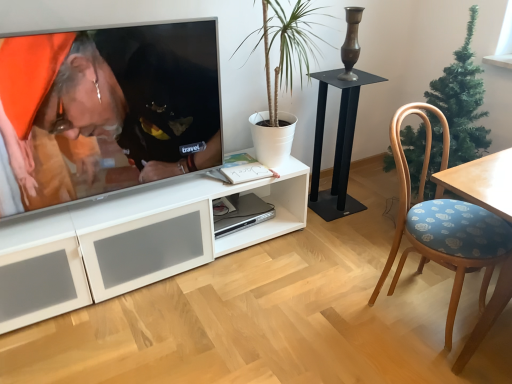
Where is `vacant position to the left of wooden chair with blue floral cushion at right`? The height and width of the screenshot is (384, 512). vacant position to the left of wooden chair with blue floral cushion at right is located at coordinates (332, 308).